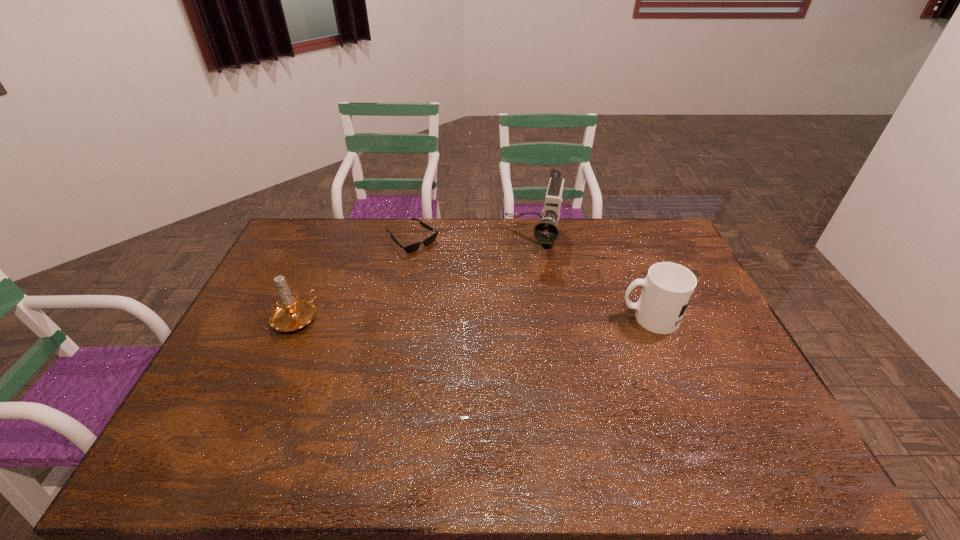
This screenshot has width=960, height=540. I want to click on free space located on the recording direction of the camcorder, so pos(520,314).

At what (x,y) coordinates should I click in order to perform the action: click on free space located on the recording direction of the camcorder. Please return your answer as a coordinate pair (x, y). Looking at the image, I should click on (524, 299).

Identify the location of vacant position located on the recording direction of the camcorder. click(512, 351).

Identify the location of blank space located on the front-facing side of the sunglasses. (441, 265).

Identify the location of blank space located on the front-facing side of the sunglasses. This screenshot has width=960, height=540. (482, 300).

This screenshot has width=960, height=540. Find the location of `free region located on the front-facing side of the sunglasses`. free region located on the front-facing side of the sunglasses is located at coordinates (492, 309).

The height and width of the screenshot is (540, 960). Identify the location of camcorder at the far edge. (546, 232).

Locate an element on the screen. sunglasses at the far edge is located at coordinates (413, 247).

Identify the location of object situated at the left edge. (291, 313).

Locate an element on the screen. The image size is (960, 540). object present at the right edge is located at coordinates (667, 289).